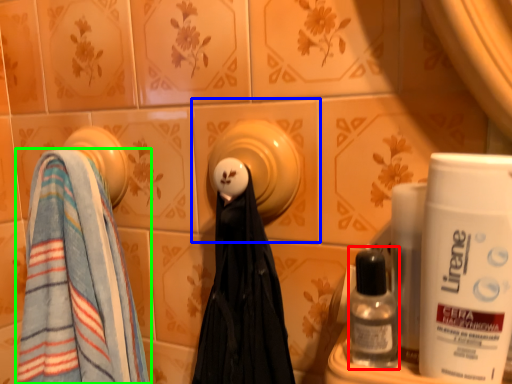
Question: Estimate the real-world distances between objects in this image. Which object is closer to mouthwash (highlighted by a red box), ceramic tile (highlighted by a blue box) or towel (highlighted by a green box)?

Choices:
 (A) ceramic tile
 (B) towel

Answer: (A)